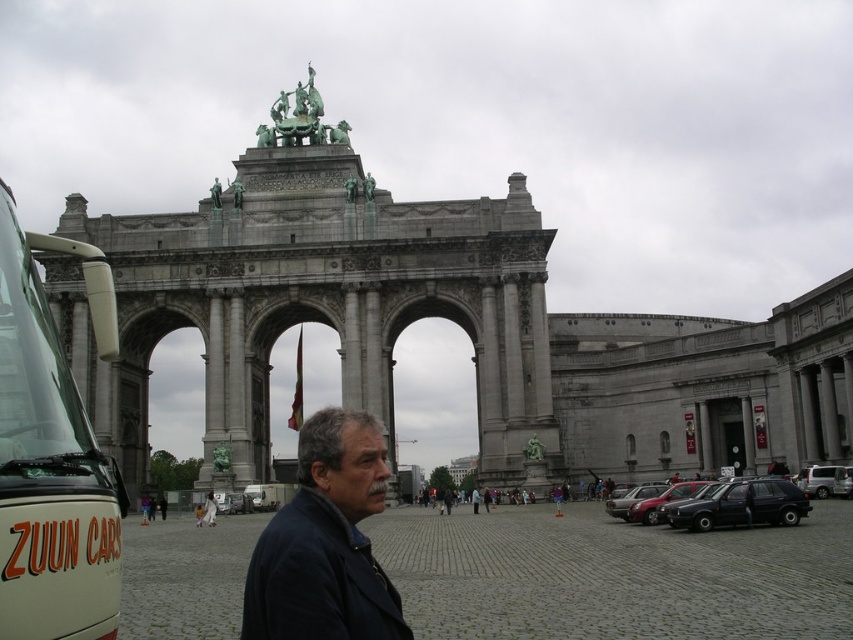
How distant is white matte bus at left from dark blue jacket at center?

A distance of 55.99 feet exists between white matte bus at left and dark blue jacket at center.

Based on the photo, is white matte bus at left wider than dark blue jacket at center?

In fact, white matte bus at left might be narrower than dark blue jacket at center.

Does point (80, 429) lie in front of point (344, 502)?

Yes, point (80, 429) is closer to viewer.

I want to click on white matte bus at left, so click(x=51, y=456).